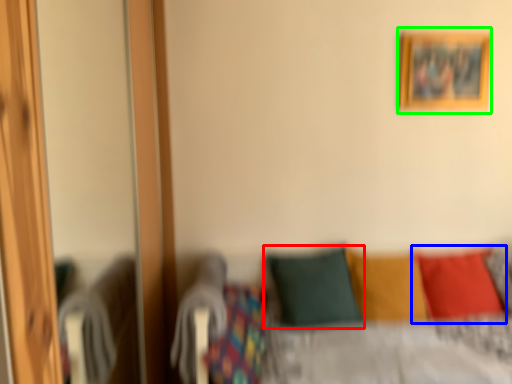
Question: Which is nearer to the pillow (highlighted by a red box)? pillow (highlighted by a blue box) or picture frame (highlighted by a green box).

Choices:
 (A) pillow
 (B) picture frame

Answer: (A)